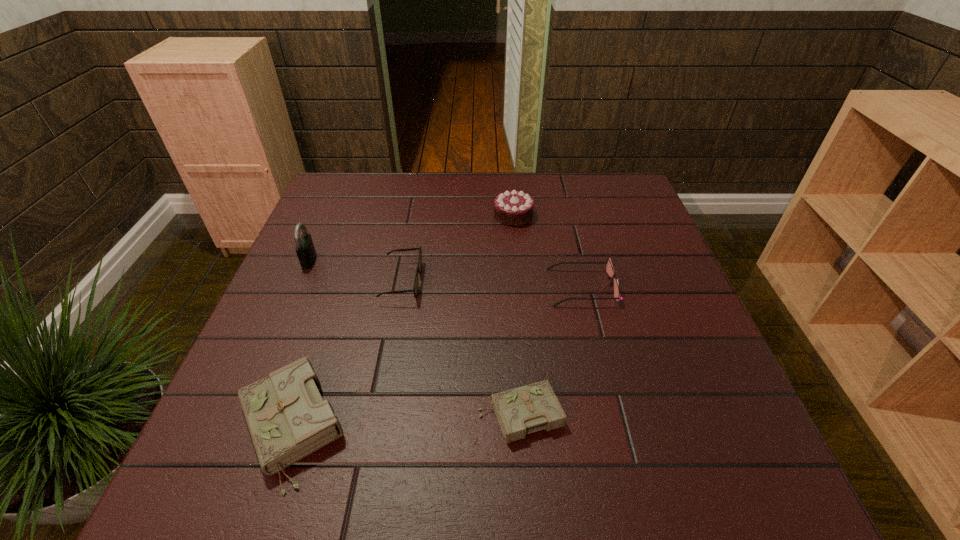
Find the location of a particular element. Image resolution: width=960 pixels, height=540 pixels. the taller diary is located at coordinates (287, 418).

Image resolution: width=960 pixels, height=540 pixels. Find the location of `the shortest object`. the shortest object is located at coordinates (520, 411).

At what (x,y) coordinates should I click in order to perform the action: click on the right diary. Please return your answer as a coordinate pair (x, y). This screenshot has height=540, width=960. Looking at the image, I should click on (520, 411).

The height and width of the screenshot is (540, 960). Identify the location of the farthest object. (513, 208).

Where is `the fifth shortest object`? the fifth shortest object is located at coordinates (513, 208).

This screenshot has width=960, height=540. What are the coordinates of `padlock` in the screenshot? It's located at (305, 250).

The height and width of the screenshot is (540, 960). I want to click on the right sunglasses, so click(x=609, y=268).

The height and width of the screenshot is (540, 960). I want to click on the fourth object from right to left, so click(x=419, y=262).

Image resolution: width=960 pixels, height=540 pixels. Identify the location of blank space located on the right of the left diary. (391, 427).

Image resolution: width=960 pixels, height=540 pixels. In order to click on vacant space located 0.390m on the left of the shortest object in this screenshot , I will do `click(268, 414)`.